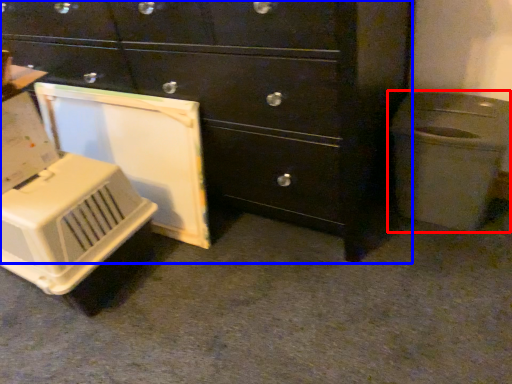
Question: Which of the following is the farthest to the observer, waste container (highlighted by a red box) or chest of drawers (highlighted by a blue box)?

Choices:
 (A) waste container
 (B) chest of drawers

Answer: (A)